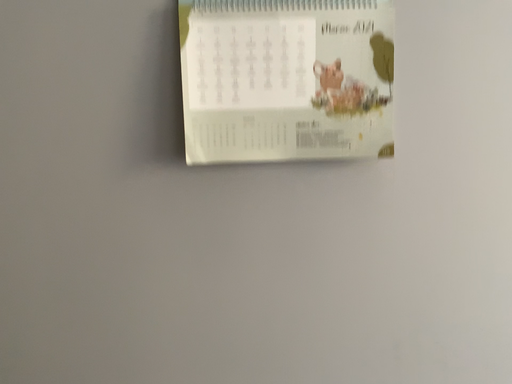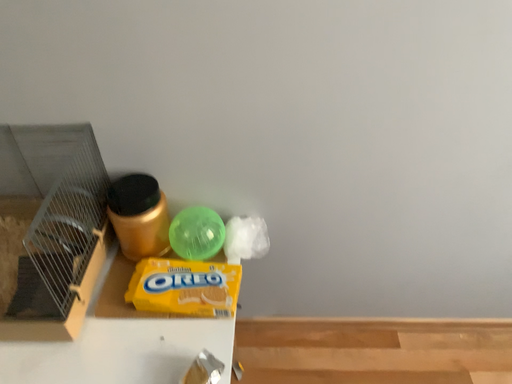
Question: How did the camera likely rotate when shooting the video?

Choices:
 (A) rotated upward
 (B) rotated downward

Answer: (B)